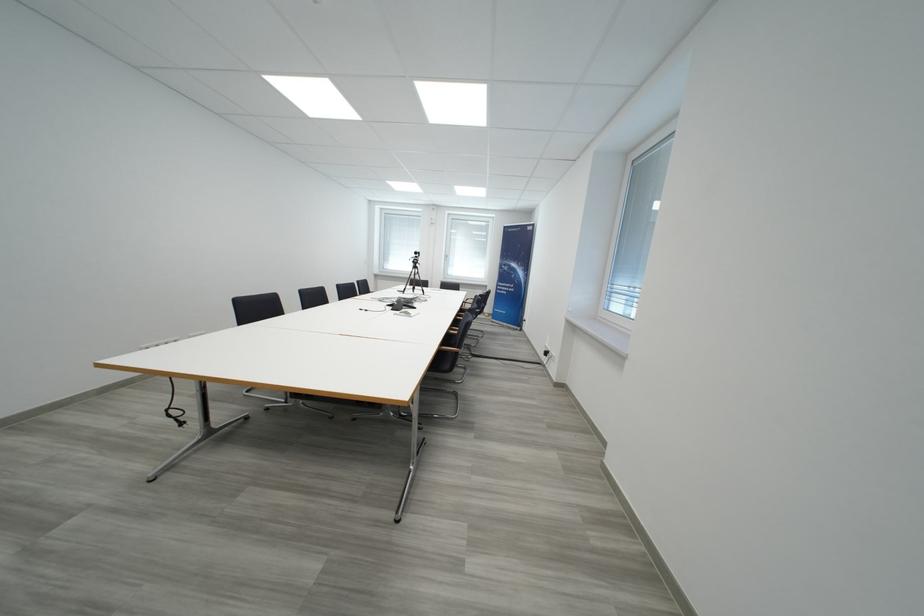
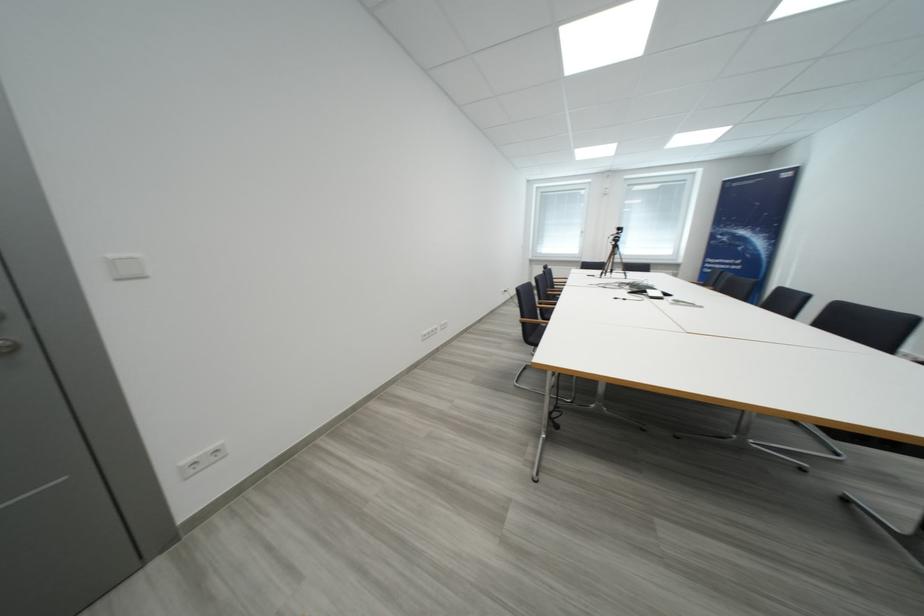
Question: Which direction would the cameraman need to move to produce the second image? Reply with the corresponding letter.

Choices:
 (A) Left
 (B) Right
 (C) Forward
 (D) Backward

Answer: (A)